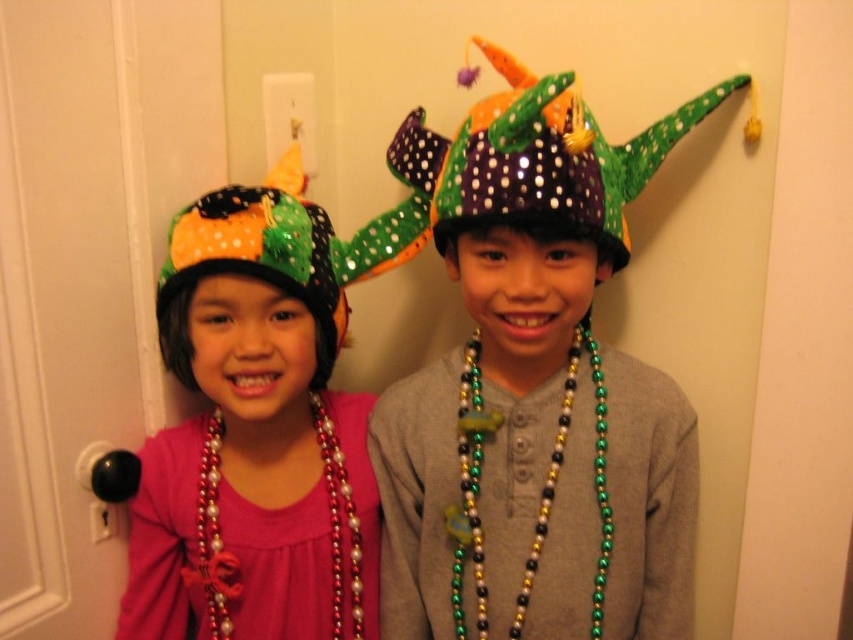
Who is higher up, multicolored beads at center or pearl beaded necklace at center?

Positioned higher is multicolored beads at center.

Can you confirm if multicolored beads at center is thinner than pearl beaded necklace at center?

No.

The height and width of the screenshot is (640, 853). Describe the element at coordinates (540, 502) in the screenshot. I see `multicolored beads at center` at that location.

The image size is (853, 640). In order to click on multicolored beads at center in this screenshot , I will do `click(540, 502)`.

Who is more distant from viewer, (x=479, y=182) or (x=202, y=237)?

The point (x=202, y=237) is behind.

Can you confirm if sparkly purple and green hat at center is positioned below shiny sequined party hat at left?

Correct, sparkly purple and green hat at center is located below shiny sequined party hat at left.

Who is more distant from viewer, (596, 612) or (392, 241)?

The point (392, 241) is behind.

Image resolution: width=853 pixels, height=640 pixels. I want to click on sparkly purple and green hat at center, so click(537, 392).

Locate an element on the screen. The width and height of the screenshot is (853, 640). shiny sequined hat at left is located at coordinates (260, 422).

Is shiny sequined hat at left positioned behind metallic beads necklace at center?

No, it is in front of metallic beads necklace at center.

The image size is (853, 640). Identify the location of shiny sequined hat at left. (260, 422).

What are the coordinates of `shiny sequined hat at left` in the screenshot? It's located at (260, 422).